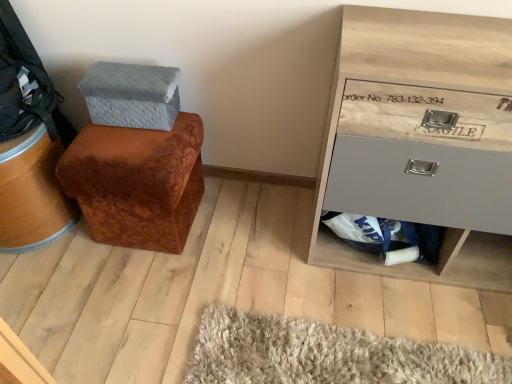
Question: Are wooden drawer at right and textured gray shoe box at upper left far apart?

Choices:
 (A) no
 (B) yes

Answer: (A)

Question: Considering the relative sizes of wooden drawer at right and textured gray shoe box at upper left in the image provided, is wooden drawer at right wider than textured gray shoe box at upper left?

Choices:
 (A) yes
 (B) no

Answer: (A)

Question: Can you confirm if wooden drawer at right is taller than textured gray shoe box at upper left?

Choices:
 (A) yes
 (B) no

Answer: (A)

Question: Considering the relative positions of wooden drawer at right and textured gray shoe box at upper left in the image provided, is wooden drawer at right to the left of textured gray shoe box at upper left from the viewer's perspective?

Choices:
 (A) yes
 (B) no

Answer: (B)

Question: Does wooden drawer at right have a lesser height compared to textured gray shoe box at upper left?

Choices:
 (A) no
 (B) yes

Answer: (A)

Question: Is wooden drawer at right turned away from textured gray shoe box at upper left?

Choices:
 (A) no
 (B) yes

Answer: (A)

Question: Can you confirm if wooden drawer at right is shorter than brown velvety ottoman at left?

Choices:
 (A) no
 (B) yes

Answer: (A)

Question: Is wooden drawer at right directly adjacent to brown velvety ottoman at left?

Choices:
 (A) yes
 (B) no

Answer: (B)

Question: Can you confirm if wooden drawer at right is wider than brown velvety ottoman at left?

Choices:
 (A) yes
 (B) no

Answer: (B)

Question: Could you tell me if wooden drawer at right is turned towards brown velvety ottoman at left?

Choices:
 (A) no
 (B) yes

Answer: (A)

Question: From the image's perspective, is wooden drawer at right beneath brown velvety ottoman at left?

Choices:
 (A) yes
 (B) no

Answer: (B)

Question: From a real-world perspective, is wooden drawer at right positioned under brown velvety ottoman at left based on gravity?

Choices:
 (A) yes
 (B) no

Answer: (B)

Question: From a real-world perspective, does brown velvety ottoman at left stand above textured gray shoe box at upper left?

Choices:
 (A) yes
 (B) no

Answer: (B)